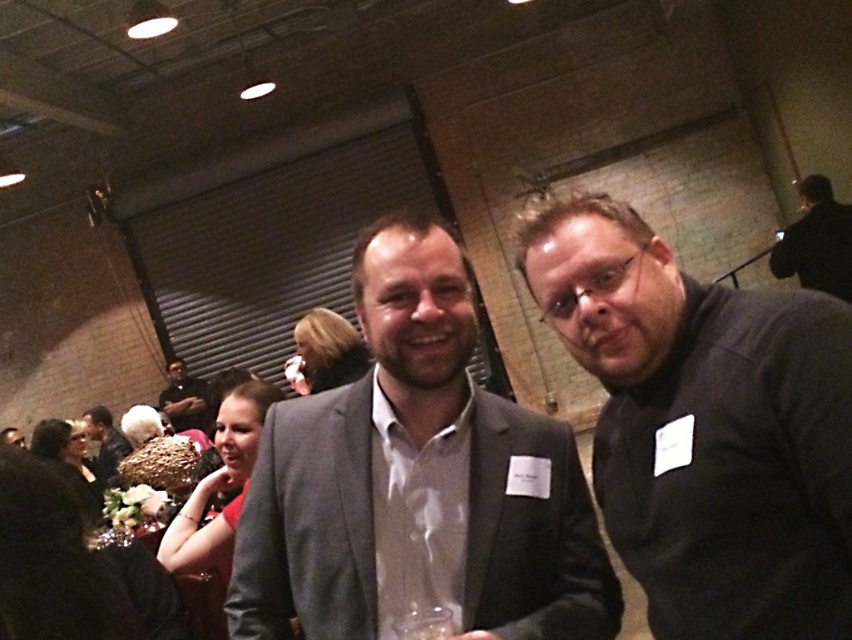
You are organizing a photo shoot and need to position a light to the left of both the dark gray sweater at right and the dark gray suit at center. Is this possible based on their current positions?

The dark gray sweater at right is to the right of the dark gray suit at center, so placing a light to the left of both would be possible as they are aligned horizontally with the sweater on the right and the suit at center. The light could be positioned to the left of the suit at center, which would also be to the left of the sweater at right.